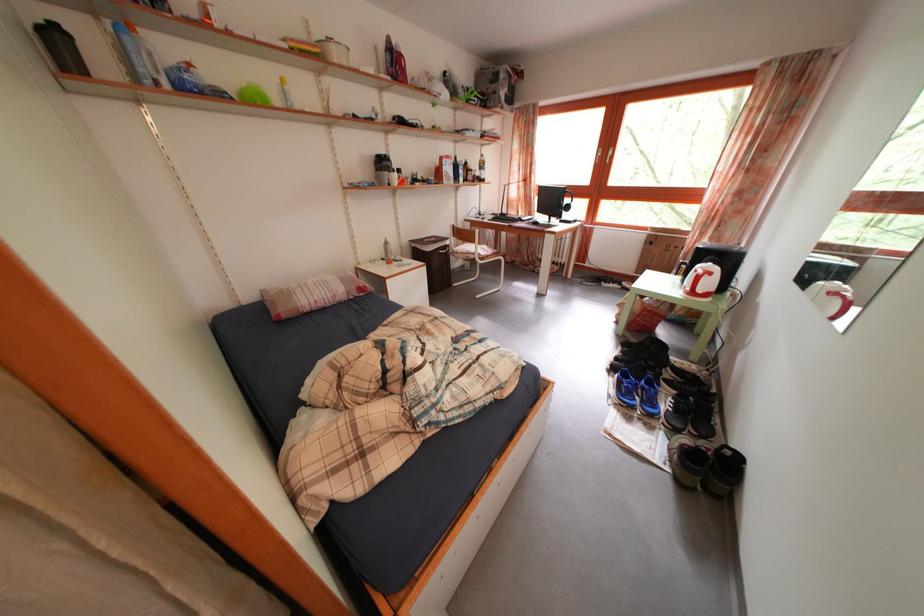
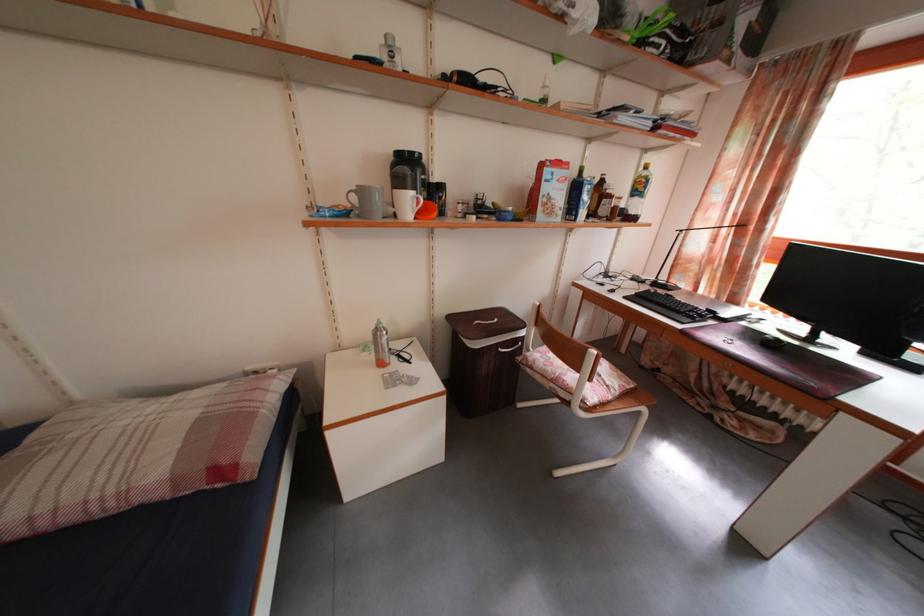
The point at (x=487, y=155) is marked in the first image. Where is the corresponding point in the second image?

(643, 161)